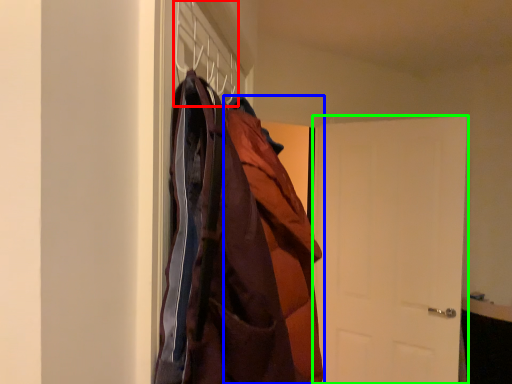
Question: Which is nearer to the hanger (highlighted by a red box)? cloak (highlighted by a blue box) or door (highlighted by a green box).

Choices:
 (A) cloak
 (B) door

Answer: (A)